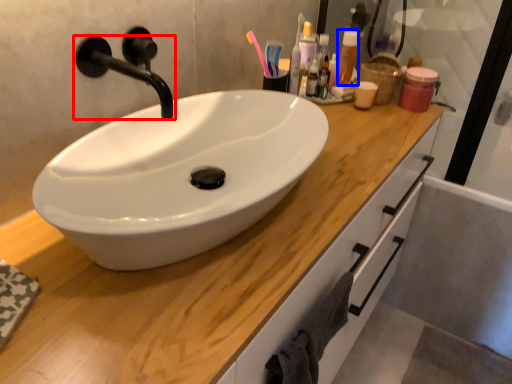
Question: Which object appears farthest to the camera in this image, tap (highlighted by a red box) or toiletry (highlighted by a blue box)?

Choices:
 (A) tap
 (B) toiletry

Answer: (B)